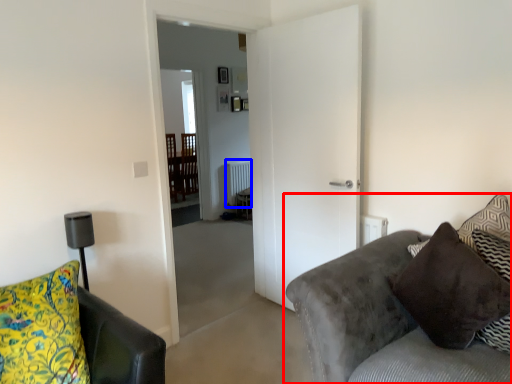
Question: Which object appears closest to the camera in this image, studio couch (highlighted by a red box) or radiator (highlighted by a blue box)?

Choices:
 (A) studio couch
 (B) radiator

Answer: (A)